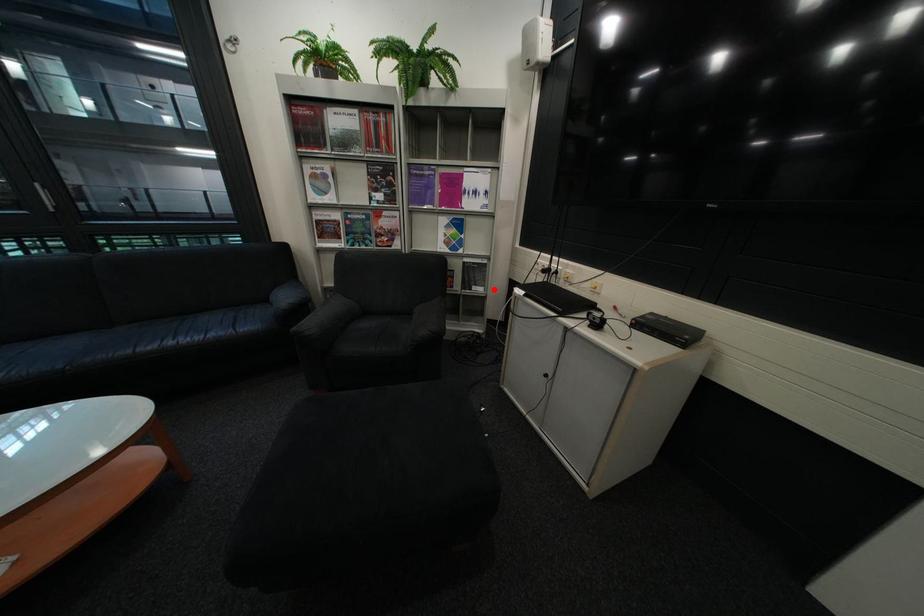
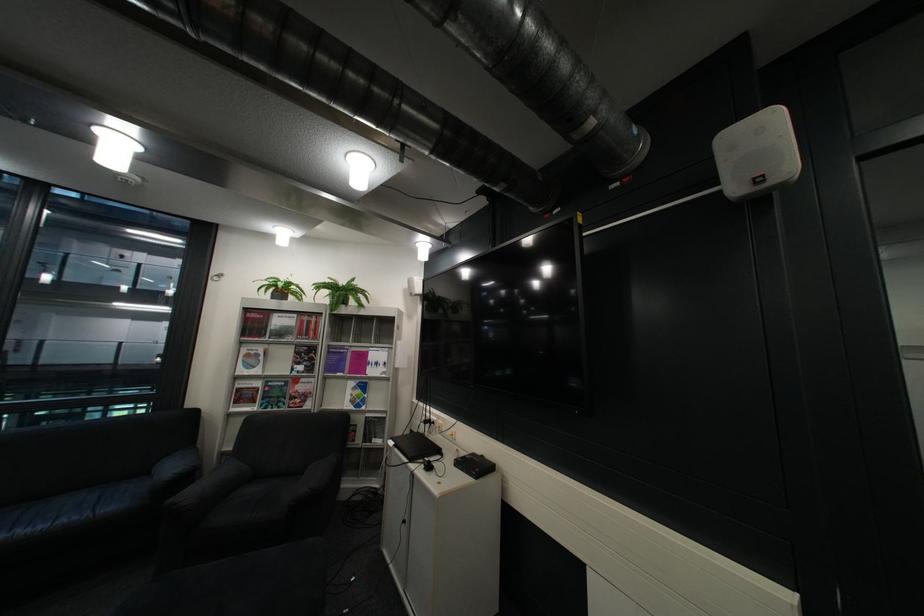
Where in the second image is the point corresponding to the highlighted location from the first image?

(393, 442)